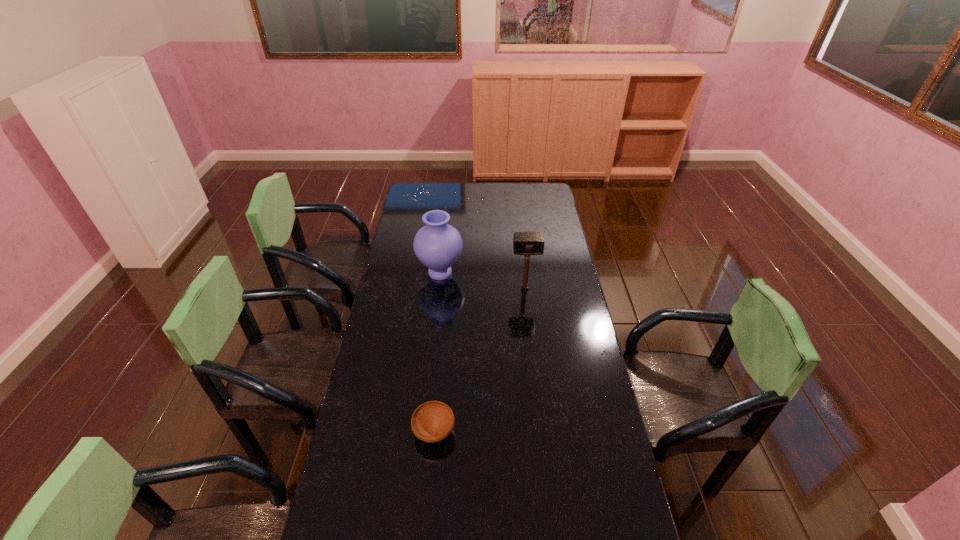
The width and height of the screenshot is (960, 540). I want to click on free space between the rightmost object and the bowl, so click(x=479, y=360).

Where is `unoccupied area between the vase and the shortest object`? This screenshot has height=540, width=960. unoccupied area between the vase and the shortest object is located at coordinates (437, 352).

You are a GUI agent. You are given a task and a screenshot of the screen. Output one action in this format:
    pyautogui.click(x=<x>, y=<y>)
    Task: Click on the free space that is in between the rightmost object and the vase
    
    Given the screenshot: What is the action you would take?
    pyautogui.click(x=482, y=281)

Locate which object is the second closest to the vase. Please provide its 2D coordinates. Your answer should be formatted as a tuple, i.e. [(x, y)], where the tuple contains the x and y coordinates of a point satisfying the conditions above.

[(433, 421)]

Locate which object is the second closest to the rightmost object. Please provide its 2D coordinates. Your answer should be formatted as a tuple, i.e. [(x, y)], where the tuple contains the x and y coordinates of a point satisfying the conditions above.

[(433, 421)]